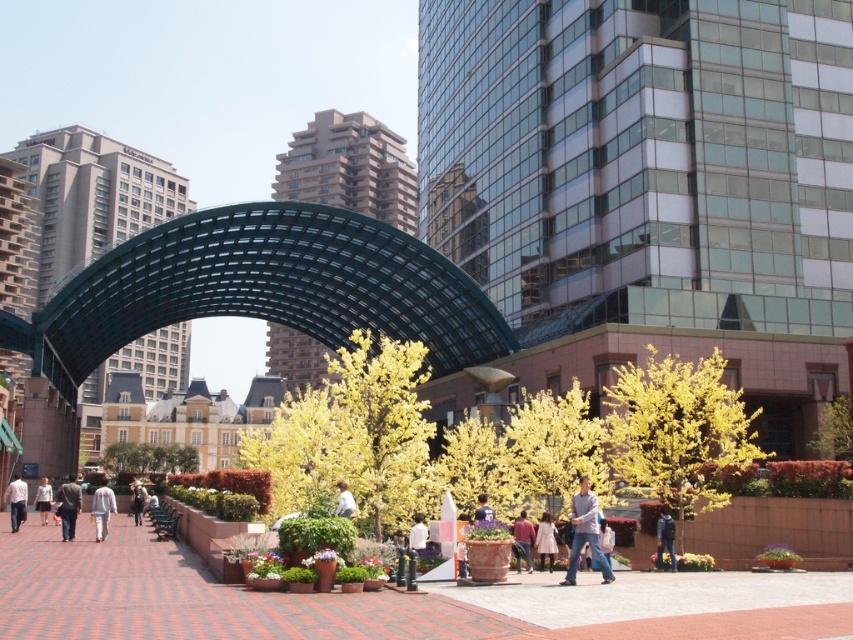
Which is more to the left, green translucent canopy at center or dark blue jacket at center?

green translucent canopy at center is more to the left.

Is green translucent canopy at center positioned before dark blue jacket at center?

No.

At what (x,y) coordinates should I click in order to perform the action: click on green translucent canopy at center. Please return your answer as a coordinate pair (x, y). The height and width of the screenshot is (640, 853). Looking at the image, I should click on (247, 300).

You are a GUI agent. You are given a task and a screenshot of the screen. Output one action in this format:
    pyautogui.click(x=<x>, y=<y>)
    Task: Click on the green translucent canopy at center
    
    Given the screenshot: What is the action you would take?
    pyautogui.click(x=247, y=300)

Is point (99, 314) closer to camera compared to point (67, 499)?

No, it is behind (67, 499).

Who is more forward, (428,250) or (74,529)?

Point (74,529) is in front.

Where is `green translucent canopy at center`? green translucent canopy at center is located at coordinates (247, 300).

Image resolution: width=853 pixels, height=640 pixels. Describe the element at coordinates (68, 506) in the screenshot. I see `dark gray suit at center` at that location.

Image resolution: width=853 pixels, height=640 pixels. I want to click on dark gray suit at center, so click(68, 506).